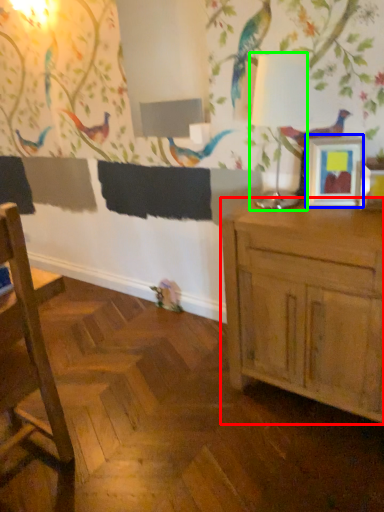
Question: Which object is the farthest from cabinetry (highlighted by a red box)? Choose among these: picture frame (highlighted by a blue box) or table lamp (highlighted by a green box).

Choices:
 (A) picture frame
 (B) table lamp

Answer: (B)